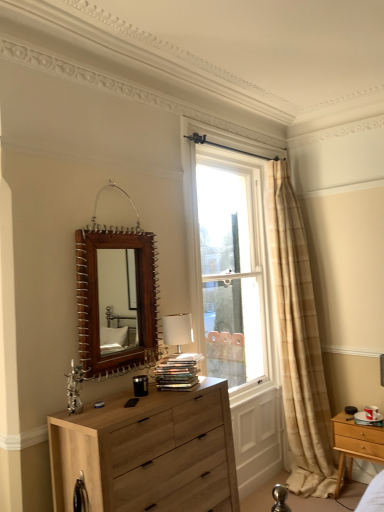
Measure the distance between point (251, 241) and camera.

3.89 meters.

The width and height of the screenshot is (384, 512). Describe the element at coordinates (117, 300) in the screenshot. I see `brown wooden mirror at upper center` at that location.

Identify the location of brown wooden mirror at upper center. This screenshot has width=384, height=512. coord(117,300).

You are a GUI agent. You are given a task and a screenshot of the screen. Output one action in this format:
    pyautogui.click(x=<x>, y=<y>)
    Task: Click on the natural wood chest of drawers at lower left
    
    Given the screenshot: What is the action you would take?
    pyautogui.click(x=149, y=453)

How much distance is there between light wood/texture nightstand at lower right and clear glass window at center?

A distance of 7.77 feet exists between light wood/texture nightstand at lower right and clear glass window at center.

Which object is more forward, light wood/texture nightstand at lower right or clear glass window at center?

Positioned in front is light wood/texture nightstand at lower right.

Is light wood/texture nightstand at lower right wider than clear glass window at center?

Indeed, light wood/texture nightstand at lower right has a greater width compared to clear glass window at center.

Is the surface of light wood/texture nightstand at lower right in direct contact with clear glass window at center?

No, light wood/texture nightstand at lower right is not with clear glass window at center.

Considering the positions of points (314, 335) and (337, 428), is point (314, 335) farther from camera compared to point (337, 428)?

Yes, it is behind point (337, 428).

From the image's perspective, is beige plaid curtain at right under light wood/texture nightstand at lower right?

No, from the image's perspective, beige plaid curtain at right is not below light wood/texture nightstand at lower right.

Locate an element on the screen. This screenshot has width=384, height=512. nightstand to the right of beige plaid curtain at right is located at coordinates (355, 443).

From a real-world perspective, which object rests below the other?

beige plaid curtain at right.

Can you tell me how much beige plaid curtain at right and clear glass window at center differ in facing direction?

The facing directions of beige plaid curtain at right and clear glass window at center are 1.57 degrees apart.

Does beige plaid curtain at right come behind clear glass window at center?

Yes, beige plaid curtain at right is behind clear glass window at center.

Can you confirm if beige plaid curtain at right is thinner than clear glass window at center?

Incorrect, the width of beige plaid curtain at right is not less than that of clear glass window at center.

Does clear glass window at center turn towards light wood/texture nightstand at lower right?

No, clear glass window at center is not oriented towards light wood/texture nightstand at lower right.

At what (x,y) coordinates should I click in order to perform the action: click on nightstand below the clear glass window at center (from a real-world perspective). Please return your answer as a coordinate pair (x, y). Image resolution: width=384 pixels, height=512 pixels. Looking at the image, I should click on (355, 443).

Relative to light wood/texture nightstand at lower right, is clear glass window at center in front or behind?

clear glass window at center is positioned farther from the viewer than light wood/texture nightstand at lower right.

Between natural wood chest of drawers at lower left and brown wooden mirror at upper center, which one has smaller width?

With smaller width is brown wooden mirror at upper center.

Which point is more distant from viewer, (127,462) or (92,256)?

The point (92,256) is farther from the camera.

Consider the image. Measure the distance between natural wood chest of drawers at lower left and brown wooden mirror at upper center.

natural wood chest of drawers at lower left and brown wooden mirror at upper center are 20.47 inches apart.

Is natural wood chest of drawers at lower left spatially inside brown wooden mirror at upper center, or outside of it?

natural wood chest of drawers at lower left is spatially situated outside brown wooden mirror at upper center.

Is brown wooden mirror at upper center oriented towards beige plaid curtain at right?

No, brown wooden mirror at upper center is not oriented towards beige plaid curtain at right.

Looking at the image, does brown wooden mirror at upper center seem bigger or smaller compared to beige plaid curtain at right?

A: brown wooden mirror at upper center is smaller than beige plaid curtain at right.

Considering the relative sizes of brown wooden mirror at upper center and beige plaid curtain at right in the image provided, is brown wooden mirror at upper center wider than beige plaid curtain at right?

In fact, brown wooden mirror at upper center might be narrower than beige plaid curtain at right.

Considering the points (102, 253) and (312, 307), which point is in front, point (102, 253) or point (312, 307)?

The point (102, 253) is more forward.

Does point (226, 459) appear closer or farther from the camera than point (311, 307)?

Clearly, point (226, 459) is closer to the camera than point (311, 307).

Is natural wood chest of drawers at lower left next to beige plaid curtain at right and touching it?

No, natural wood chest of drawers at lower left is not in contact with beige plaid curtain at right.

Is natural wood chest of drawers at lower left spatially inside beige plaid curtain at right, or outside of it?

natural wood chest of drawers at lower left is spatially situated outside beige plaid curtain at right.

Which object is positioned more to the right, natural wood chest of drawers at lower left or beige plaid curtain at right?

Positioned to the right is beige plaid curtain at right.

I want to click on window on the left of light wood/texture nightstand at lower right, so click(x=231, y=262).

Where is `curtain above the light wood/texture nightstand at lower right (from a real-world perspective)`? The height and width of the screenshot is (512, 384). curtain above the light wood/texture nightstand at lower right (from a real-world perspective) is located at coordinates (299, 342).

Looking at this image, looking at the image, which one is located closer to clear glass window at center, beige plaid curtain at right or brown wooden mirror at upper center?

Based on the image, beige plaid curtain at right appears to be nearer to clear glass window at center.

From the image, which object appears to be farther from clear glass window at center, natural wood chest of drawers at lower left or light wood/texture nightstand at lower right?

natural wood chest of drawers at lower left.

Which object lies further to the anchor point light wood/texture nightstand at lower right, beige plaid curtain at right or clear glass window at center?

The object further to light wood/texture nightstand at lower right is clear glass window at center.

Which object lies further to the anchor point clear glass window at center, brown wooden mirror at upper center or light wood/texture nightstand at lower right?

brown wooden mirror at upper center is positioned further to the anchor clear glass window at center.

Based on their spatial positions, is beige plaid curtain at right or light wood/texture nightstand at lower right further from natural wood chest of drawers at lower left?

The object further to natural wood chest of drawers at lower left is beige plaid curtain at right.

Which object lies nearer to the anchor point light wood/texture nightstand at lower right, natural wood chest of drawers at lower left or beige plaid curtain at right?

beige plaid curtain at right is positioned closer to the anchor light wood/texture nightstand at lower right.

Which object lies nearer to the anchor point light wood/texture nightstand at lower right, brown wooden mirror at upper center or clear glass window at center?

The object closer to light wood/texture nightstand at lower right is brown wooden mirror at upper center.

From the image, which object appears to be farther from brown wooden mirror at upper center, clear glass window at center or natural wood chest of drawers at lower left?

clear glass window at center is positioned further to the anchor brown wooden mirror at upper center.

Locate an element on the screen. chest of drawers between brown wooden mirror at upper center and light wood/texture nightstand at lower right from left to right is located at coordinates (149, 453).

Locate an element on the screen. This screenshot has width=384, height=512. mirror located between natural wood chest of drawers at lower left and beige plaid curtain at right in the depth direction is located at coordinates (117, 300).

At what (x,y) coordinates should I click in order to perform the action: click on window located between brown wooden mirror at upper center and light wood/texture nightstand at lower right in the left-right direction. Please return your answer as a coordinate pair (x, y). The width and height of the screenshot is (384, 512). Looking at the image, I should click on coord(231,262).

The width and height of the screenshot is (384, 512). Find the location of `nightstand between natural wood chest of drawers at lower left and beige plaid curtain at right in the front-back direction`. nightstand between natural wood chest of drawers at lower left and beige plaid curtain at right in the front-back direction is located at coordinates (355, 443).